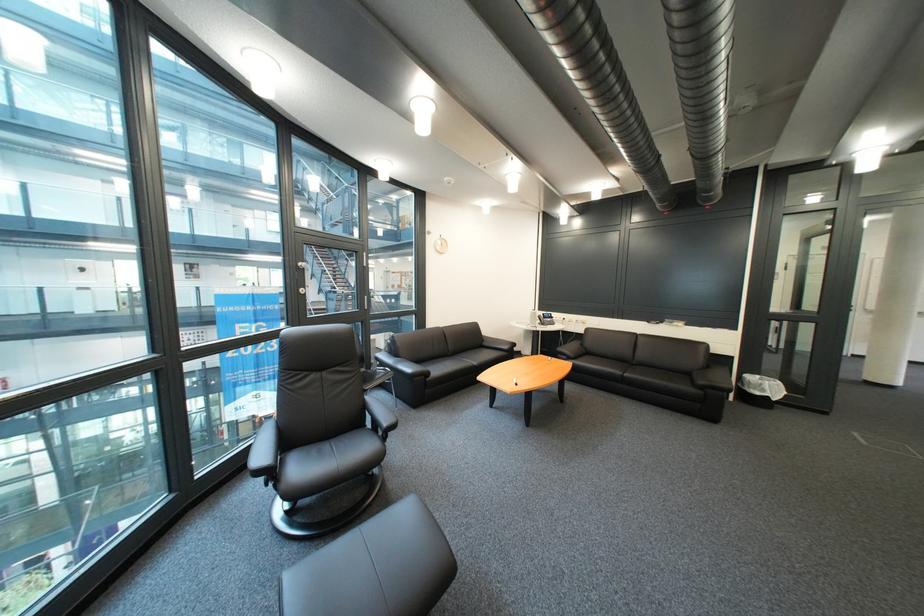
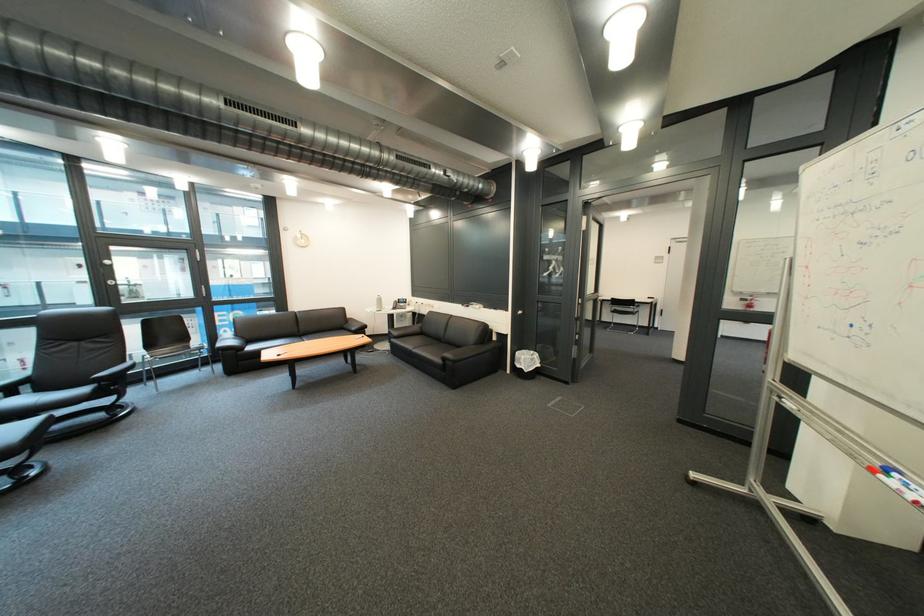
The point at (748, 331) is marked in the first image. Where is the corresponding point in the second image?

(520, 312)